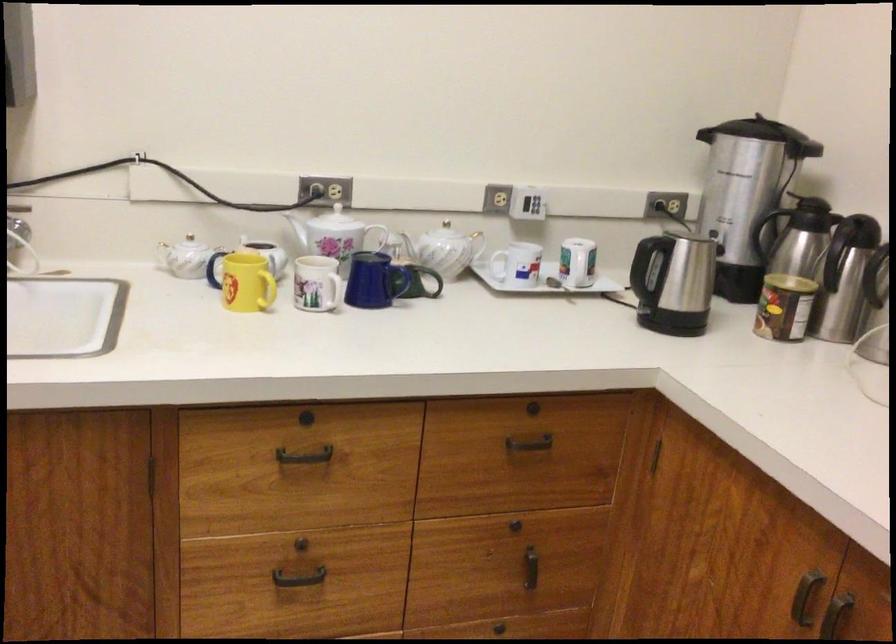
Where is `electric kettle handle`? electric kettle handle is located at coordinates (420, 281).